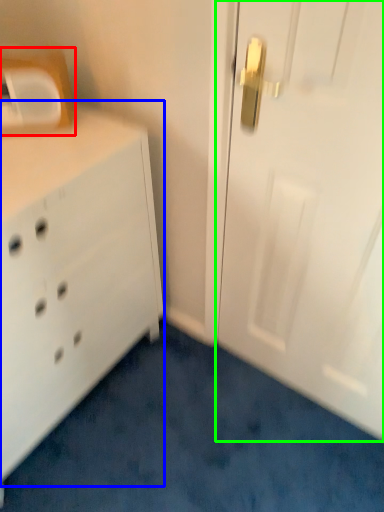
Question: Based on their relative distances, which object is nearer to medicine cabinet (highlighted by a red box)? Choose from chest of drawers (highlighted by a blue box) and door (highlighted by a green box).

Choices:
 (A) chest of drawers
 (B) door

Answer: (A)